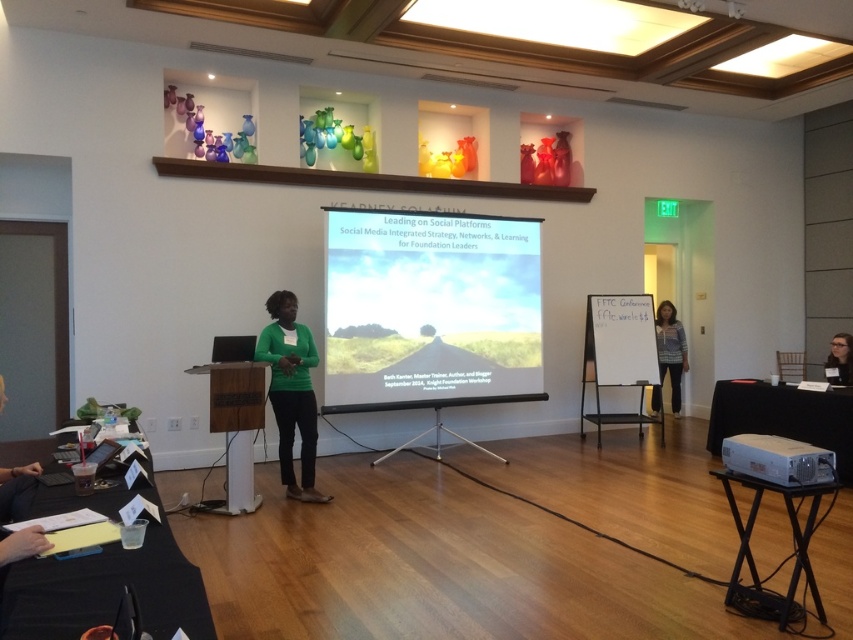
You are an attendee at the conference. You notice the white plastic projector at lower right and the matte black glasses at upper right. Which object is positioned lower in the image?

The white plastic projector at lower right is located below matte black glasses at upper right, so the white plastic projector at lower right is positioned lower in the image.

You are organizing a small event and need to place a large banner between the white plastic projector at lower right and the striped sweater at right. Based on their sizes, which object should the banner be placed closer to?

The banner should be placed closer to the striped sweater at right because the white plastic projector at lower right occupies less space, meaning the striped sweater at right is larger and requires more space between them.